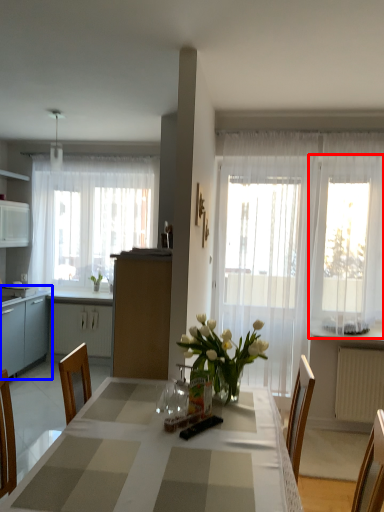
Question: Which object appears farthest to the camera in this image, window (highlighted by a red box) or cabinetry (highlighted by a blue box)?

Choices:
 (A) window
 (B) cabinetry

Answer: (B)